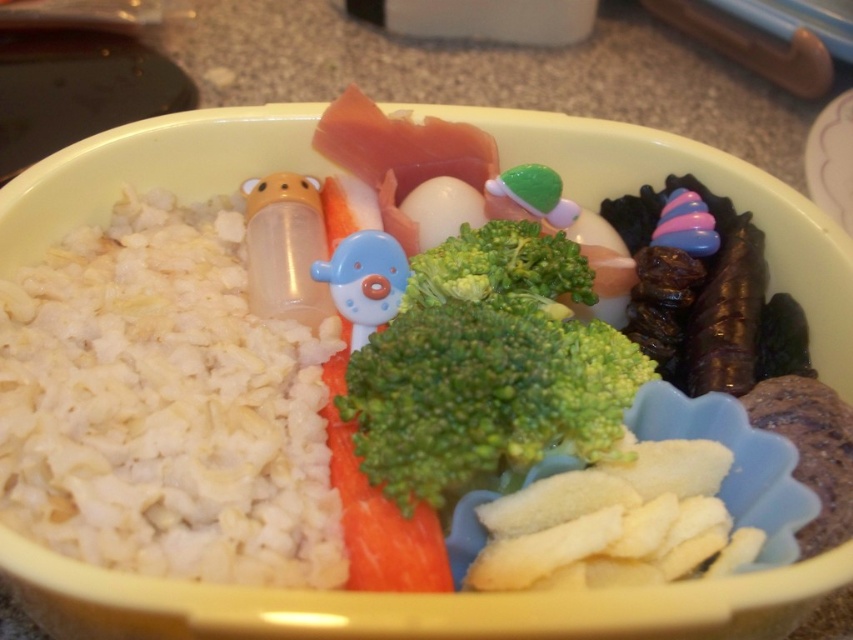
You are looking at the colorful meal in the yellow bowl. There are two points marked in the image. One is at coordinate point (218, 532) and the other is at point (497, 276). Which of these two points is closer to you?

Point (218, 532) is closer to the viewer than point (497, 276).

In the scene shown: You are a food critic evaluating the presentation of this meal. Based on the image, where is the white fluffy rice at left in relation to the green fresh carrot at center?

The white fluffy rice at left is located above the green fresh carrot at center.